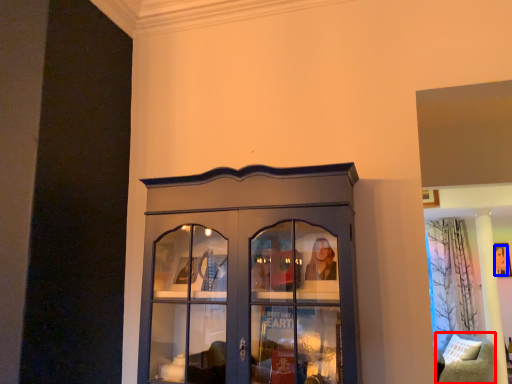
Question: Which point is further to the camera, furniture (highlighted by a red box) or person (highlighted by a blue box)?

Choices:
 (A) furniture
 (B) person

Answer: (B)